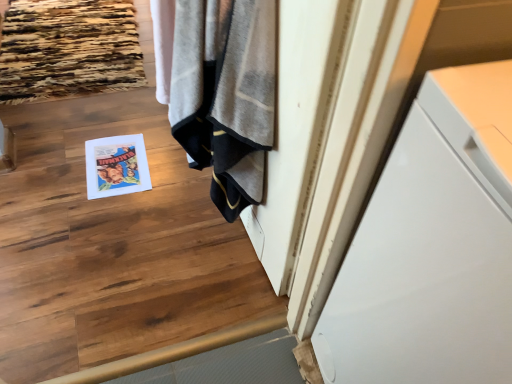
Question: Is the depth of gray textured towel at center greater than that of matte paper magazine at center?

Choices:
 (A) yes
 (B) no

Answer: (B)

Question: Can you confirm if gray textured towel at center is positioned to the left of matte paper magazine at center?

Choices:
 (A) no
 (B) yes

Answer: (A)

Question: Can you confirm if gray textured towel at center is smaller than matte paper magazine at center?

Choices:
 (A) no
 (B) yes

Answer: (A)

Question: Is gray textured towel at center to the right of matte paper magazine at center from the viewer's perspective?

Choices:
 (A) yes
 (B) no

Answer: (A)

Question: Does gray textured towel at center have a lesser width compared to matte paper magazine at center?

Choices:
 (A) no
 (B) yes

Answer: (B)

Question: Considering the positions of matte paper magazine at center and gray textured towel at center in the image, is matte paper magazine at center taller or shorter than gray textured towel at center?

Choices:
 (A) short
 (B) tall

Answer: (A)

Question: Is matte paper magazine at center bigger or smaller than gray textured towel at center?

Choices:
 (A) small
 (B) big

Answer: (A)

Question: Considering their positions, is matte paper magazine at center located in front of or behind gray textured towel at center?

Choices:
 (A) behind
 (B) front

Answer: (A)

Question: Visually, is matte paper magazine at center positioned to the left or to the right of gray textured towel at center?

Choices:
 (A) right
 (B) left

Answer: (B)

Question: From a real-world perspective, is gray textured towel at center positioned above or below matte paper magazine at center?

Choices:
 (A) above
 (B) below

Answer: (A)

Question: From the image's perspective, relative to matte paper magazine at center, is gray textured towel at center above or below?

Choices:
 (A) below
 (B) above

Answer: (B)

Question: Is gray textured towel at center inside or outside of matte paper magazine at center?

Choices:
 (A) inside
 (B) outside

Answer: (B)

Question: From their relative heights in the image, would you say gray textured towel at center is taller or shorter than matte paper magazine at center?

Choices:
 (A) short
 (B) tall

Answer: (B)

Question: Is point (133, 137) closer or farther from the camera than point (391, 286)?

Choices:
 (A) farther
 (B) closer

Answer: (A)

Question: From the image's perspective, relative to white glossy cabinet at right, is matte paper magazine at center above or below?

Choices:
 (A) below
 (B) above

Answer: (B)